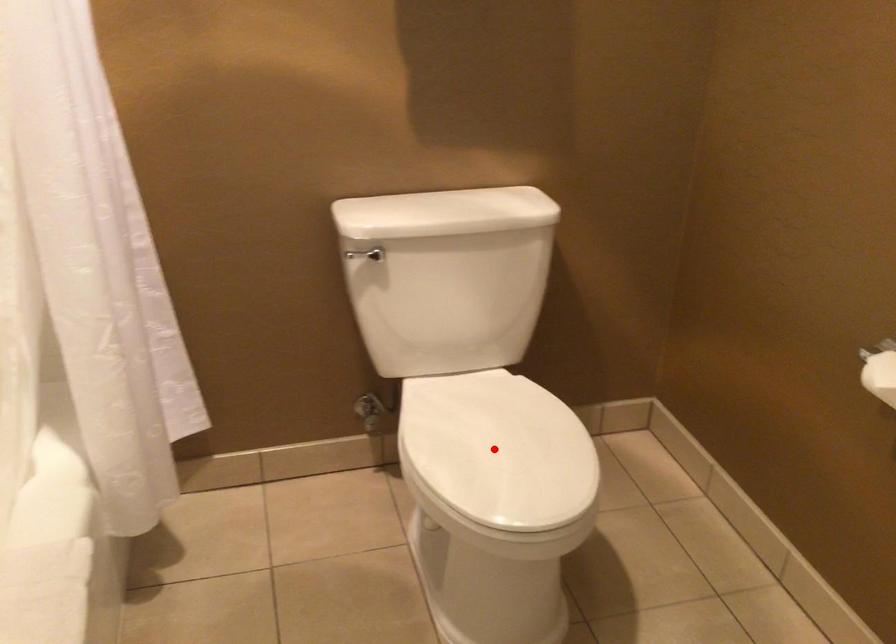
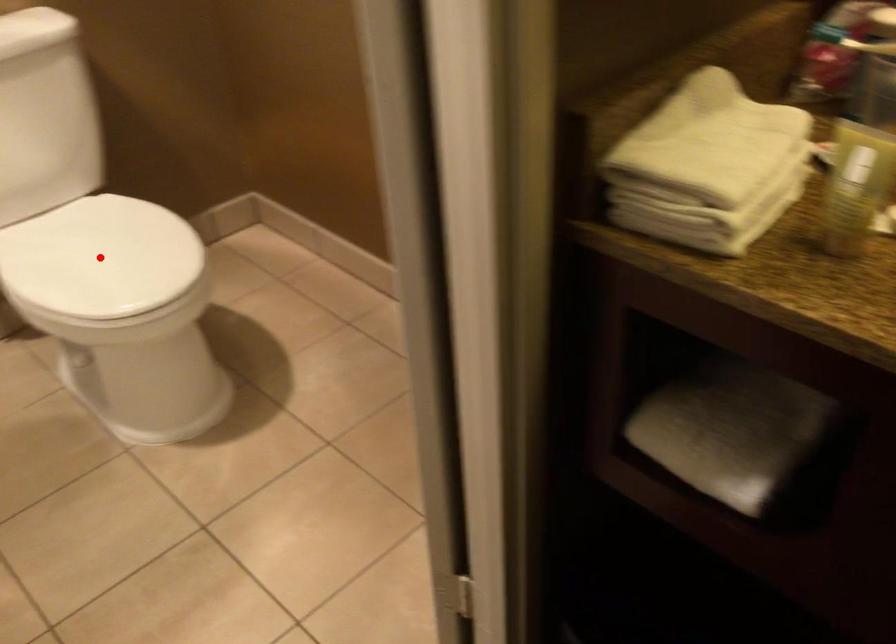
I am providing you with two images of the same scene from different viewpoints. A red point is marked on the first image and another point is marked on the second image. Do the highlighted points in image1 and image2 indicate the same real-world spot?

Yes